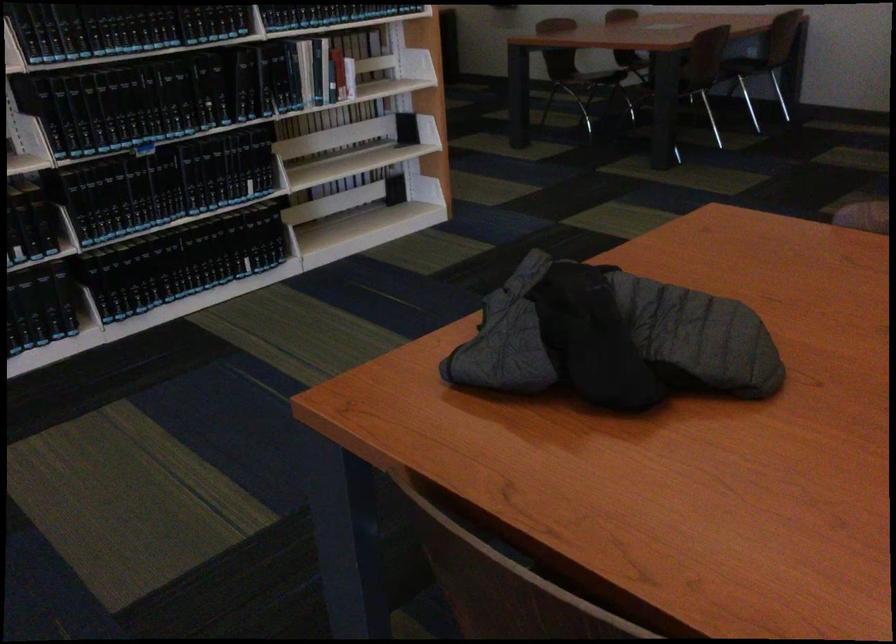
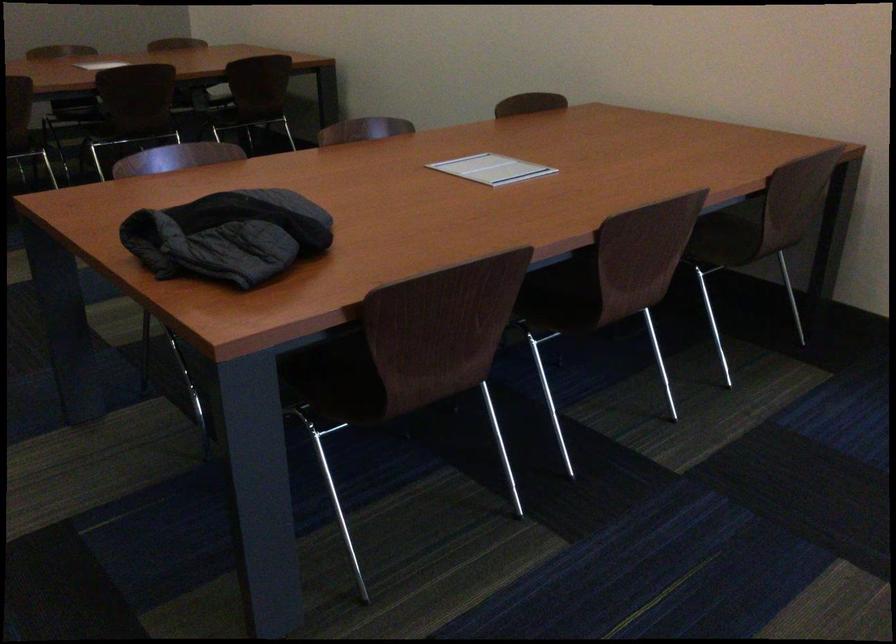
Find the pixel in the second image that matches point (538, 317) in the first image.

(228, 236)